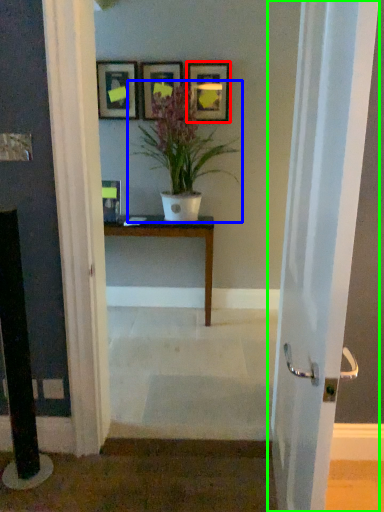
Question: Which object is the farthest from picture frame (highlighted by a red box)? Choose among these: houseplant (highlighted by a blue box) or door (highlighted by a green box).

Choices:
 (A) houseplant
 (B) door

Answer: (B)